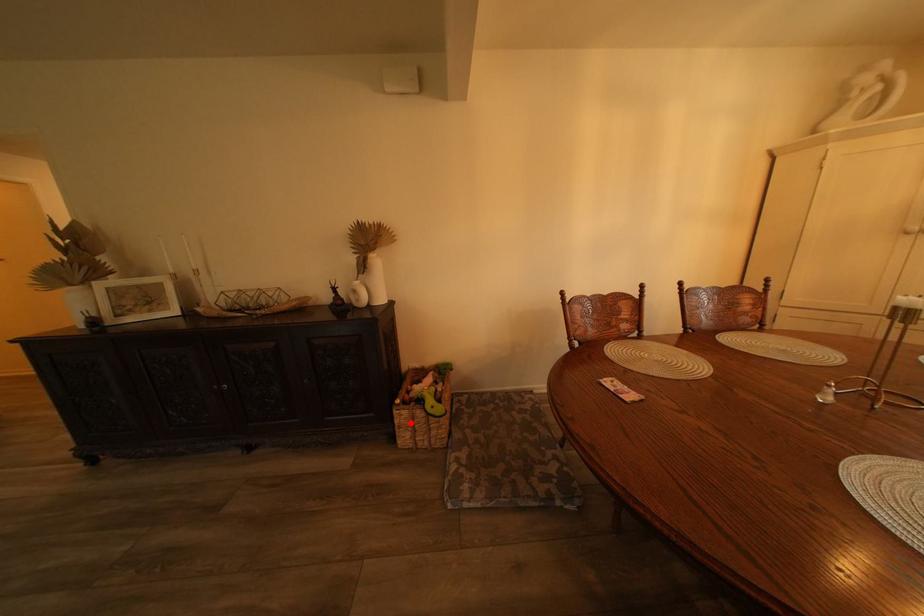
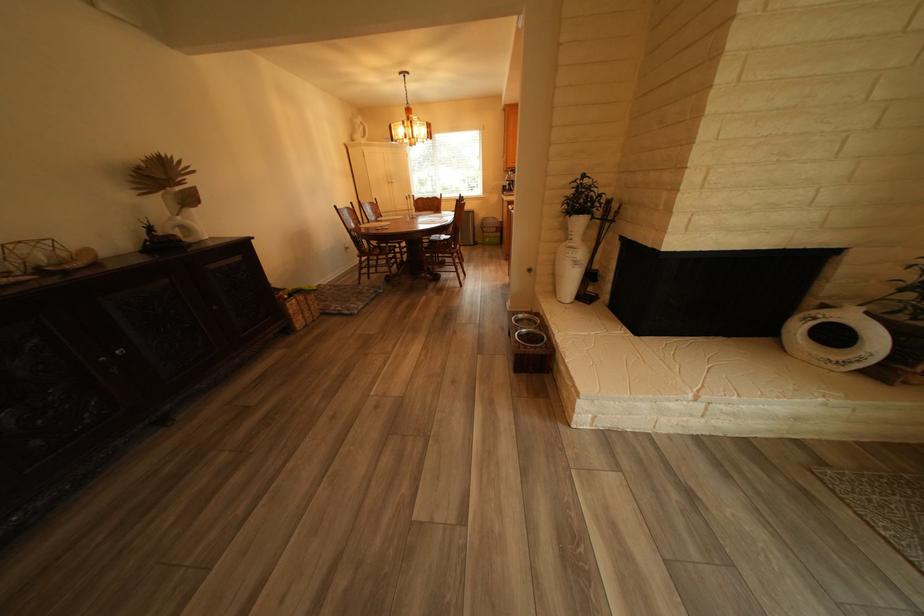
Question: I am providing you with two images of the same scene from different viewpoints. Given a red point in image1, look at the same physical point in image2. Is it:

Choices:
 (A) Closer to the viewpoint
 (B) Farther from the viewpoint

Answer: (A)